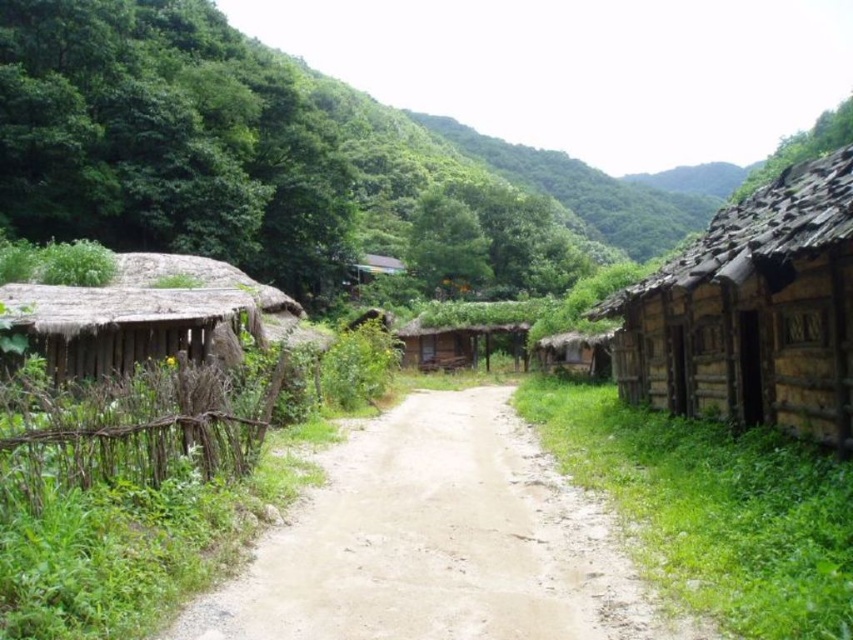
Question: Which is farther from the rustic wooden hut at right?

Choices:
 (A) brown dirt track at center
 (B) brown thatched hut at center

Answer: (B)

Question: Does brown dirt track at center appear under brown thatched hut at center?

Choices:
 (A) yes
 (B) no

Answer: (A)

Question: Is brown dirt track at center in front of brown thatched hut at center?

Choices:
 (A) no
 (B) yes

Answer: (B)

Question: Which of the following is the closest to the observer?

Choices:
 (A) (370, 595)
 (B) (766, 417)
 (C) (465, 346)

Answer: (A)

Question: Among these objects, which one is nearest to the camera?

Choices:
 (A) rustic wooden hut at right
 (B) brown thatched hut at center
 (C) brown dirt track at center

Answer: (C)

Question: Does rustic wooden hut at right have a larger size compared to brown thatched hut at center?

Choices:
 (A) no
 (B) yes

Answer: (B)